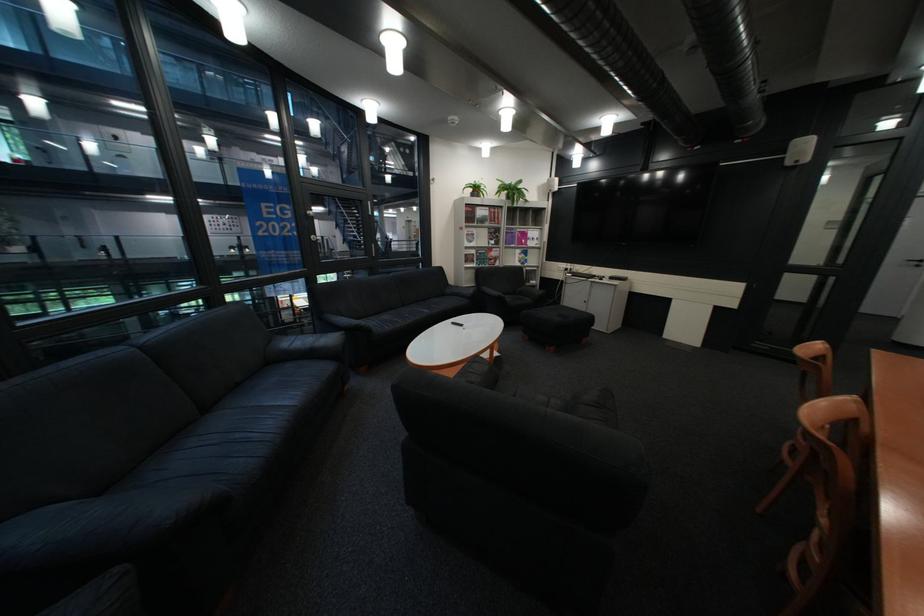
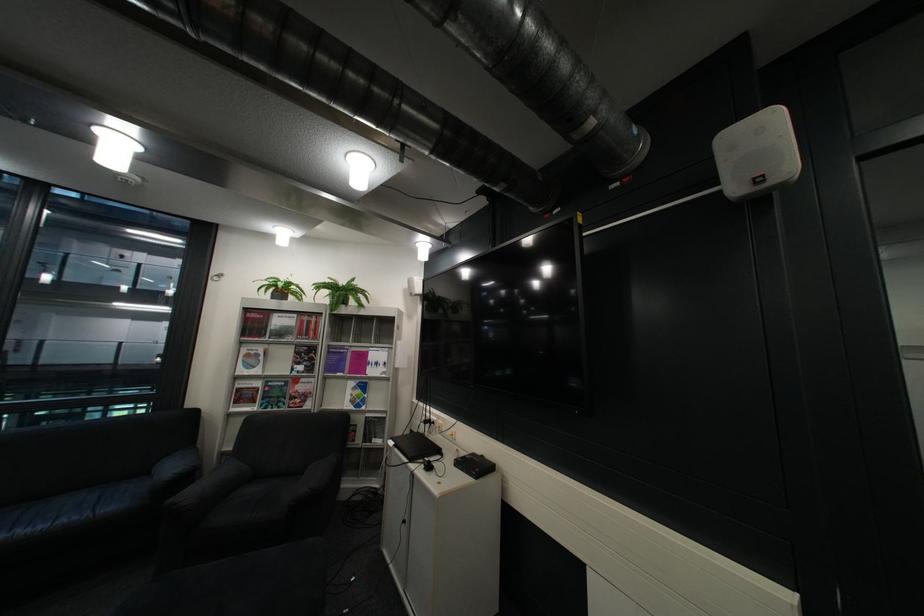
Find the pixel in the second image that matches (x=565, y=191) in the first image.

(427, 294)